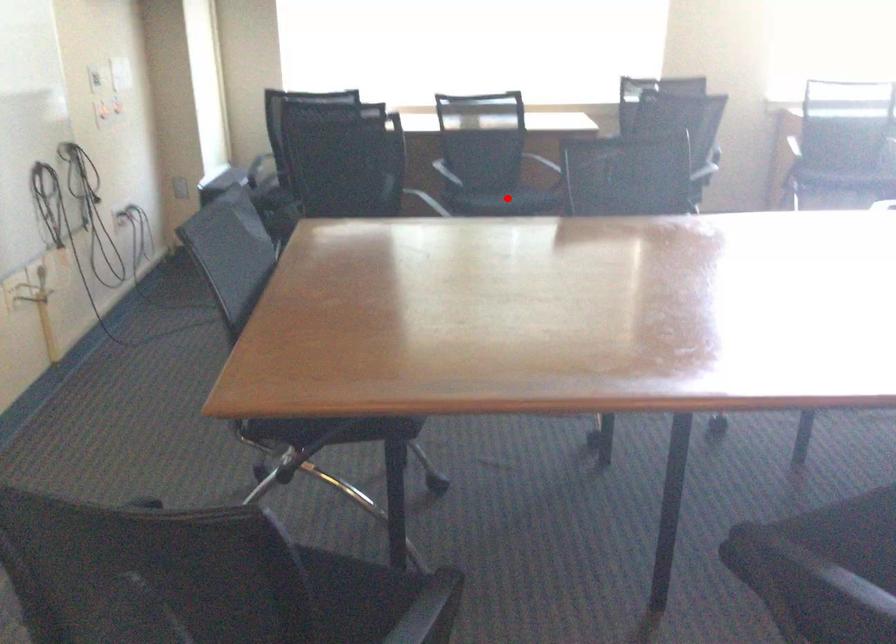
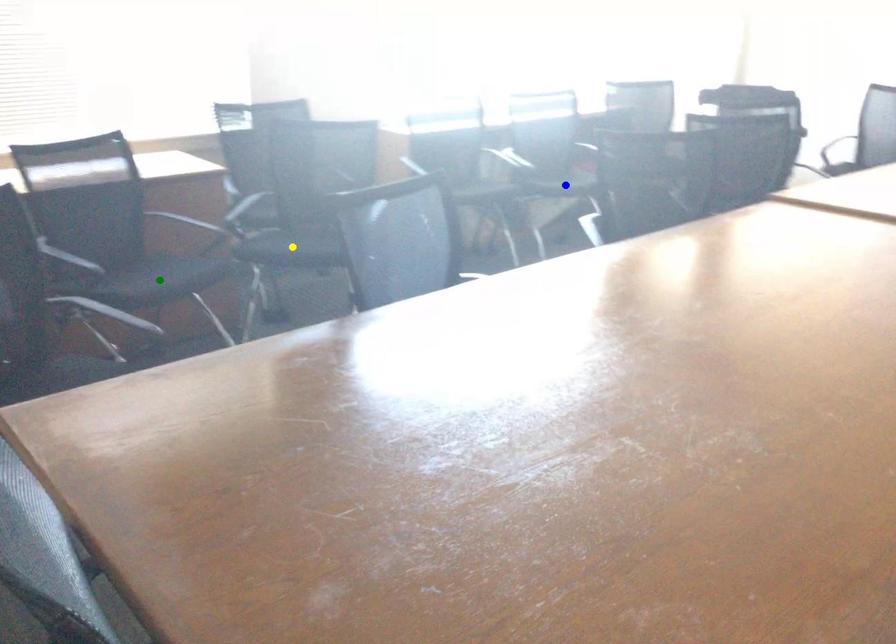
Question: I am providing you with two images of the same scene from different viewpoints. A red point is marked on the first image. You are given multiple points on the second image. Which point in image 2 represents the same 3d spot as the red point in image 1?

Choices:
 (A) blue point
 (B) green point
 (C) yellow point

Answer: (B)